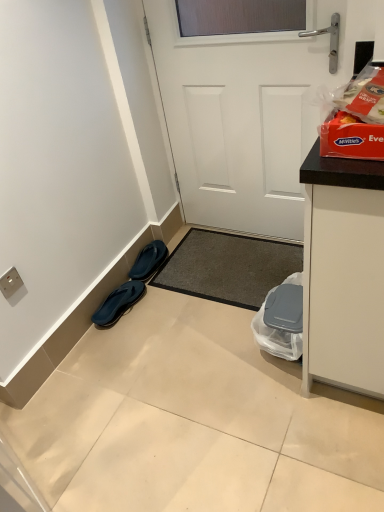
Question: From the image's perspective, is white matte door at center located beneath black rubber flip-flops at lower left, which ranks as the second footwear in bottom-to-top order?

Choices:
 (A) no
 (B) yes

Answer: (A)

Question: Does white matte door at center have a larger size compared to black rubber flip-flops at lower left, which ranks as the second footwear in bottom-to-top order?

Choices:
 (A) yes
 (B) no

Answer: (A)

Question: Is white matte door at center outside black rubber flip-flops at lower left, which ranks as the second footwear in bottom-to-top order?

Choices:
 (A) no
 (B) yes

Answer: (B)

Question: Does white matte door at center have a smaller size compared to black rubber flip-flops at lower left, which ranks as the second footwear in bottom-to-top order?

Choices:
 (A) yes
 (B) no

Answer: (B)

Question: Considering the relative positions of white matte door at center and black rubber flip-flops at lower left, which ranks as the second footwear in bottom-to-top order, in the image provided, is white matte door at center behind black rubber flip-flops at lower left, which ranks as the second footwear in bottom-to-top order,?

Choices:
 (A) no
 (B) yes

Answer: (A)

Question: In terms of height, does dark gray carpet at center look taller or shorter compared to black rubber flip-flops at lower left, which appears as the 1th footwear when ordered from the bottom?

Choices:
 (A) short
 (B) tall

Answer: (A)

Question: From a real-world perspective, is dark gray carpet at center positioned above or below black rubber flip-flops at lower left, the second footwear when ordered from top to bottom?

Choices:
 (A) above
 (B) below

Answer: (B)

Question: Based on their sizes in the image, would you say dark gray carpet at center is bigger or smaller than black rubber flip-flops at lower left, the second footwear when ordered from top to bottom?

Choices:
 (A) small
 (B) big

Answer: (B)

Question: Considering the positions of dark gray carpet at center and black rubber flip-flops at lower left, which appears as the 1th footwear when ordered from the bottom, in the image, is dark gray carpet at center wider or thinner than black rubber flip-flops at lower left, which appears as the 1th footwear when ordered from the bottom,?

Choices:
 (A) wide
 (B) thin

Answer: (A)

Question: Is black rubber flip-flops at lower left, which appears as the 1th footwear when ordered from the bottom, to the left or to the right of white plastic electric outlet at lower left in the image?

Choices:
 (A) left
 (B) right

Answer: (B)

Question: Based on their sizes in the image, would you say black rubber flip-flops at lower left, the second footwear when ordered from top to bottom, is bigger or smaller than white plastic electric outlet at lower left?

Choices:
 (A) small
 (B) big

Answer: (B)

Question: Which is correct: black rubber flip-flops at lower left, which appears as the 1th footwear when ordered from the bottom, is inside white plastic electric outlet at lower left, or outside of it?

Choices:
 (A) outside
 (B) inside

Answer: (A)

Question: Considering the positions of black rubber flip-flops at lower left, the second footwear when ordered from top to bottom, and white plastic electric outlet at lower left in the image, is black rubber flip-flops at lower left, the second footwear when ordered from top to bottom, wider or thinner than white plastic electric outlet at lower left?

Choices:
 (A) thin
 (B) wide

Answer: (B)

Question: Is black rubber flip-flops at lower left, which is counted as the 1th footwear, starting from the top, inside the boundaries of white plastic electric outlet at lower left, or outside?

Choices:
 (A) inside
 (B) outside

Answer: (B)

Question: Considering their positions, is black rubber flip-flops at lower left, which is counted as the 1th footwear, starting from the top, located in front of or behind white plastic electric outlet at lower left?

Choices:
 (A) front
 (B) behind

Answer: (B)